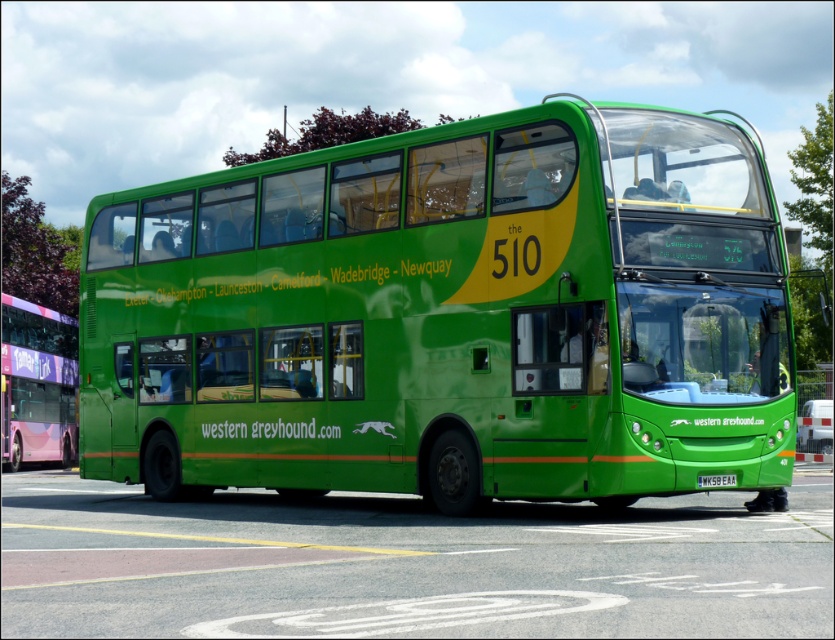
The image size is (835, 640). I want to click on matte pink bus at left, so click(x=38, y=385).

Based on the photo, which is more to the left, matte pink bus at left or white plastic license plate at center?

Positioned to the left is matte pink bus at left.

Between point (23, 381) and point (720, 484), which one is positioned behind?

The point (23, 381) is behind.

Identify the location of matte pink bus at left. (38, 385).

What are the coordinates of `green matte/deck bus at center` in the screenshot? It's located at (449, 316).

Can you confirm if green matte/deck bus at center is positioned above matte pink bus at left?

Indeed, green matte/deck bus at center is positioned over matte pink bus at left.

At what (x,y) coordinates should I click in order to perform the action: click on green matte/deck bus at center. Please return your answer as a coordinate pair (x, y). The height and width of the screenshot is (640, 835). Looking at the image, I should click on (449, 316).

Can you confirm if green matte/deck bus at center is positioned to the right of white plastic license plate at center?

Incorrect, green matte/deck bus at center is not on the right side of white plastic license plate at center.

Which is below, green matte/deck bus at center or white plastic license plate at center?

white plastic license plate at center

Who is more distant from viewer, (x=289, y=424) or (x=727, y=486)?

The point (x=289, y=424) is behind.

What are the coordinates of `green matte/deck bus at center` in the screenshot? It's located at (449, 316).